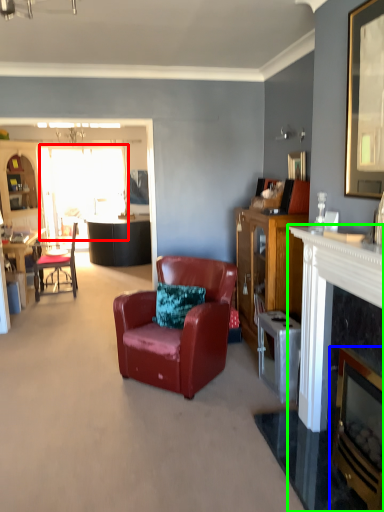
Question: Which object is positioned farthest from glass door (highlighted by a red box)? Select from fireplace (highlighted by a blue box) and fireplace (highlighted by a green box).

Choices:
 (A) fireplace
 (B) fireplace

Answer: (A)